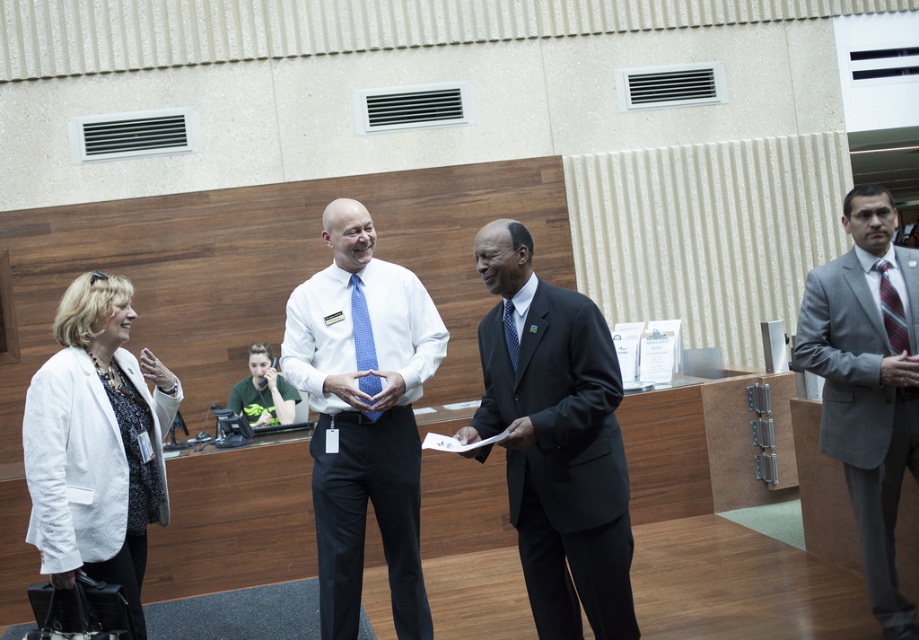
Question: Is gray suit at right closer to the viewer compared to blue dotted tie at center?

Choices:
 (A) yes
 (B) no

Answer: (B)

Question: Which is nearer to the black suit at center?

Choices:
 (A) white fabric jacket at left
 (B) striped silk tie at right

Answer: (A)

Question: Among these objects, which one is nearest to the camera?

Choices:
 (A) blue textured tie at center
 (B) striped silk tie at right
 (C) blue dotted tie at center
 (D) matte white shirt at center

Answer: (C)

Question: Which point is farther to the camera?

Choices:
 (A) black suit at center
 (B) blue dotted tie at center

Answer: (B)

Question: Is white fabric jacket at left bigger than blue dotted tie at center?

Choices:
 (A) no
 (B) yes

Answer: (B)

Question: Can you confirm if matte white shirt at center is smaller than gray suit at right?

Choices:
 (A) no
 (B) yes

Answer: (A)